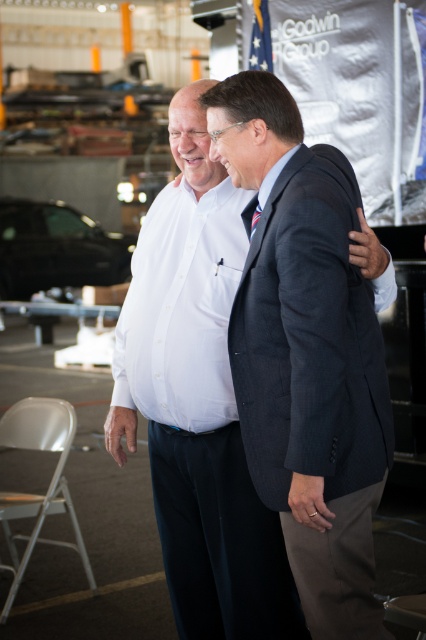
You are a photographer standing at the entrance of the warehouse. You want to take a photo of the shiny black car at center and the striped silk tie at center in the same frame. Given that your camera has a maximum focus range of 30 feet, will both objects be in focus?

The distance between the shiny black car at center and the striped silk tie at center is 33.94 feet. Since the camera can only focus up to 30 feet, the objects are too far apart for both to be in focus simultaneously.

You are a photographer setting up a photo shoot in the described scene. You need to ensure that both the white shirt at center and the striped silk tie at center are clearly visible in the final image. Given their sizes, which object should you focus on first to ensure proper exposure, and why?

The white shirt at center has a larger size compared to the striped silk tie at center, so you should focus on the white shirt at center first to ensure proper exposure because its larger size will dominate the composition and require accurate lighting adjustments.